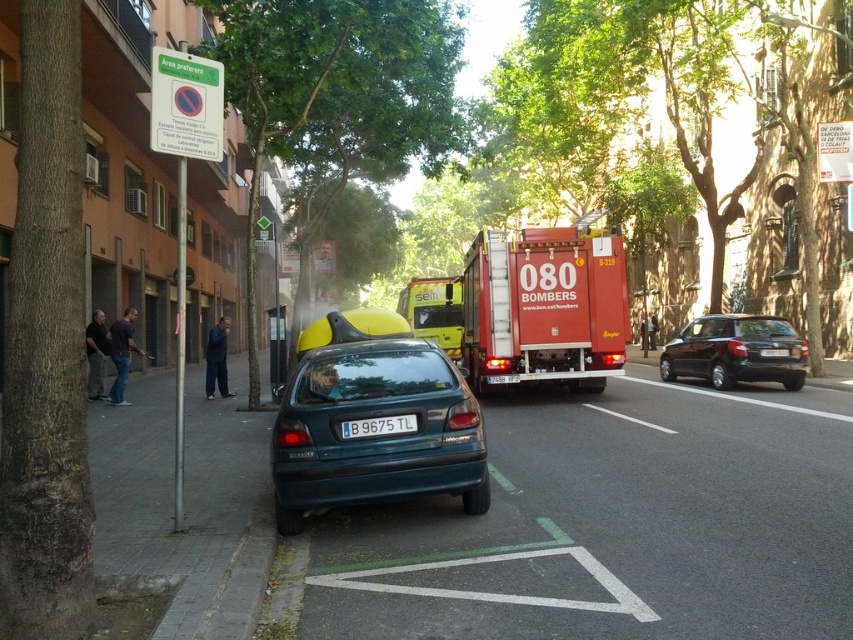
Question: Is red matte fire truck at center to the right of black plastic license plate at center from the viewer's perspective?

Choices:
 (A) no
 (B) yes

Answer: (B)

Question: Estimate the real-world distances between objects in this image. Which object is farther from the teal matte hatchback at center?

Choices:
 (A) white plastic license plate at center
 (B) black plastic license plate at center
 (C) shiny black sedan at right

Answer: (C)

Question: Considering the real-world distances, which object is closest to the red matte fire truck at center?

Choices:
 (A) white plastic license plate at center
 (B) shiny black sedan at right
 (C) black plastic license plate at center
 (D) teal matte hatchback at center

Answer: (A)

Question: From the image, what is the correct spatial relationship of teal matte hatchback at center in relation to black plastic license plate at center?

Choices:
 (A) below
 (B) above

Answer: (A)

Question: Is shiny black sedan at right bigger than white plastic license plate at center?

Choices:
 (A) no
 (B) yes

Answer: (B)

Question: Which point appears closest to the camera in this image?

Choices:
 (A) (529, 337)
 (B) (386, 428)

Answer: (B)